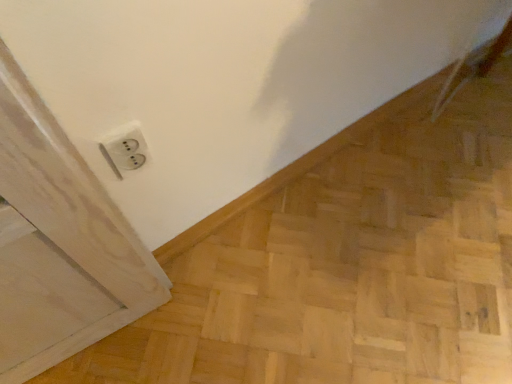
Measure the distance between point (127, 133) and camera.

Point (127, 133) is 27.05 inches away from camera.

The image size is (512, 384). Find the location of `white plastic outlet at upper left`. white plastic outlet at upper left is located at coordinates (124, 149).

This screenshot has height=384, width=512. What do you see at coordinates (124, 149) in the screenshot?
I see `white plastic outlet at upper left` at bounding box center [124, 149].

Where is `white plastic outlet at upper left`? The width and height of the screenshot is (512, 384). white plastic outlet at upper left is located at coordinates (124, 149).